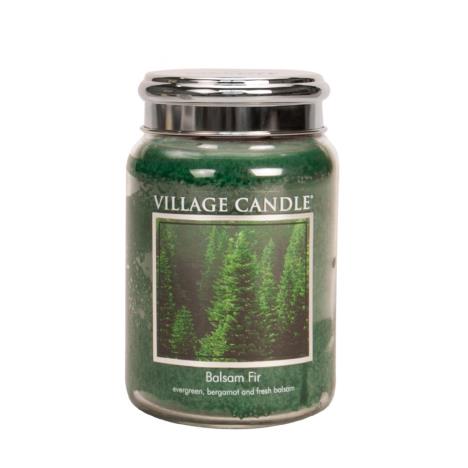
Identify the location of light reflection on jar. (198, 178), (265, 175), (255, 144), (205, 146).